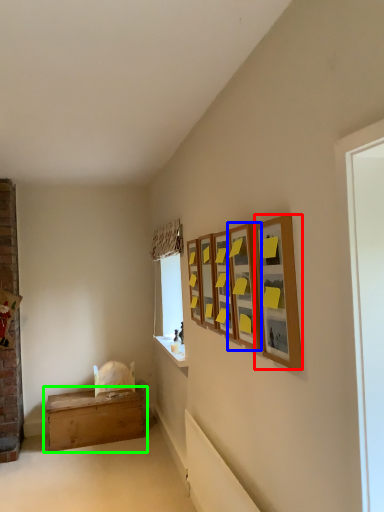
Question: Which object is positioned farthest from picture frame (highlighted by a red box)? Select from picture frame (highlighted by a blue box) and table (highlighted by a green box).

Choices:
 (A) picture frame
 (B) table

Answer: (B)